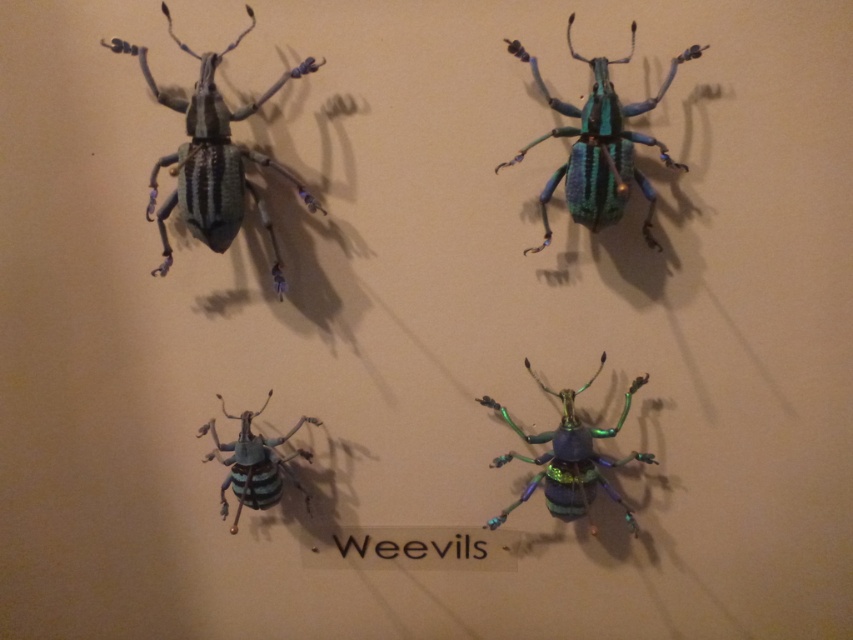
You are an entomologist studying the weevils mounted on the beige wall. You need to determine which of the two weevils, the matte black beetle at upper left or the metallic iridescent weevil at center, has a greater height. Based on the arrangement, can you deduce which one is taller?

The matte black beetle at upper left is much taller than the metallic iridescent weevil at center according to the description.